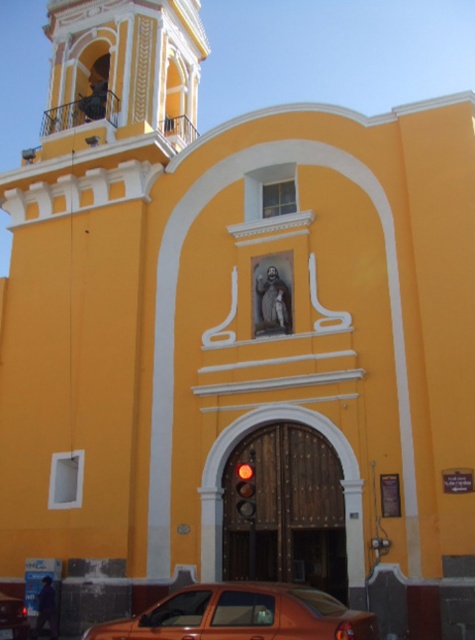
Can you confirm if orange metallic car at lower center is shorter than orange matte car at lower left?

Incorrect, orange metallic car at lower center's height does not fall short of orange matte car at lower left's.

Can you confirm if orange metallic car at lower center is positioned below orange matte car at lower left?

Actually, orange metallic car at lower center is above orange matte car at lower left.

Is point (319, 628) less distant than point (5, 620)?

Yes, it is.

You are a GUI agent. You are given a task and a screenshot of the screen. Output one action in this format:
    pyautogui.click(x=<x>, y=<y>)
    Task: Click on the orange metallic car at lower center
    Image resolution: width=475 pixels, height=640 pixels.
    Given the screenshot: What is the action you would take?
    pyautogui.click(x=241, y=614)